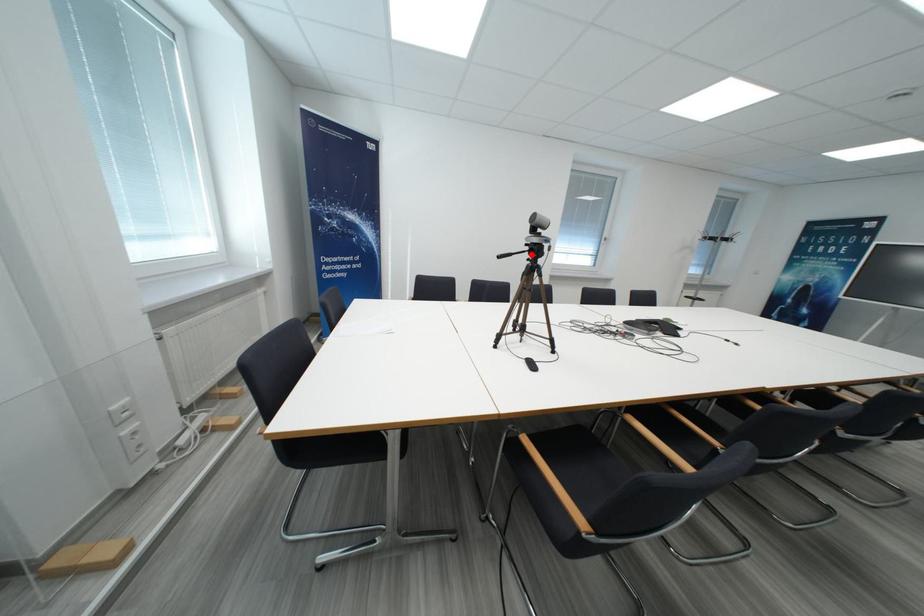
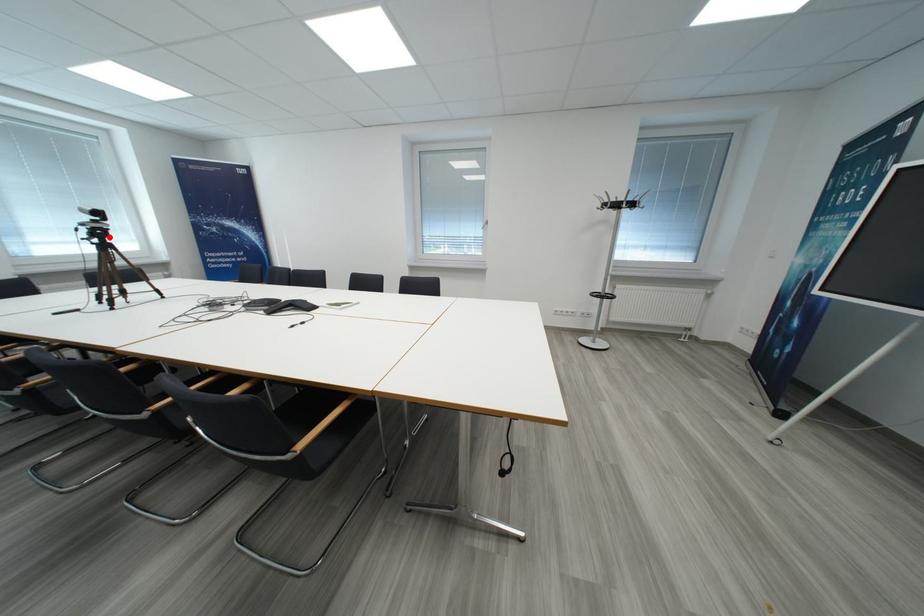
I am providing you with two images of the same scene from different viewpoints. A red point is marked on the first image and another point is marked on the second image. Does the point marked in image1 correspond to the same location as the one in image2?

Yes